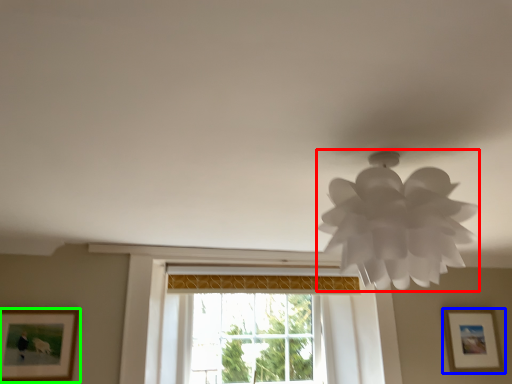
Question: Based on their relative distances, which object is farther from lamp (highlighted by a red box)? Choose from picture frame (highlighted by a blue box) and picture frame (highlighted by a green box).

Choices:
 (A) picture frame
 (B) picture frame

Answer: (A)